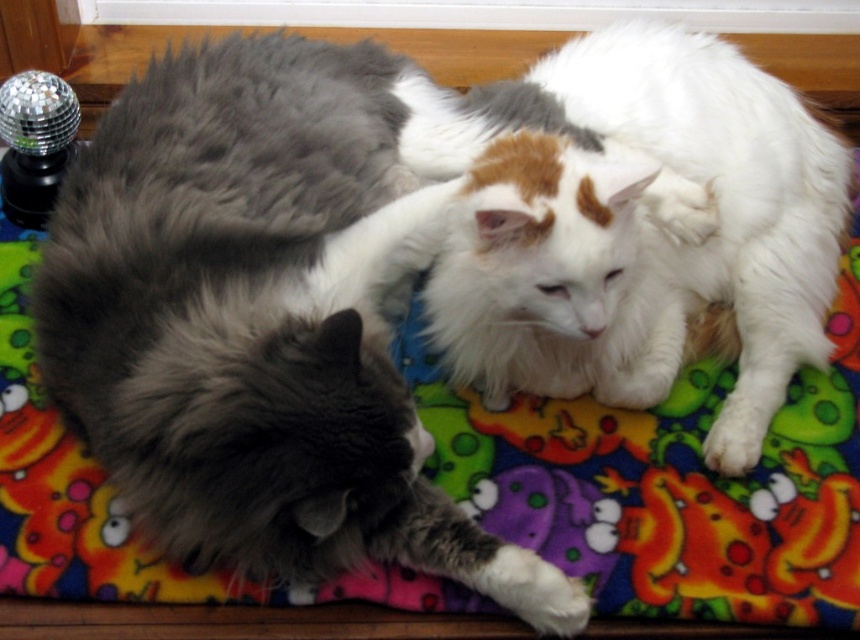
Is fluffy gray cat at center positioned behind white fluffy cat at center?

That is False.

Is fluffy gray cat at center above white fluffy cat at center?

No, fluffy gray cat at center is not above white fluffy cat at center.

You are a GUI agent. You are given a task and a screenshot of the screen. Output one action in this format:
    pyautogui.click(x=<x>, y=<y>)
    Task: Click on the fluffy gray cat at center
    
    Given the screenshot: What is the action you would take?
    pyautogui.click(x=262, y=321)